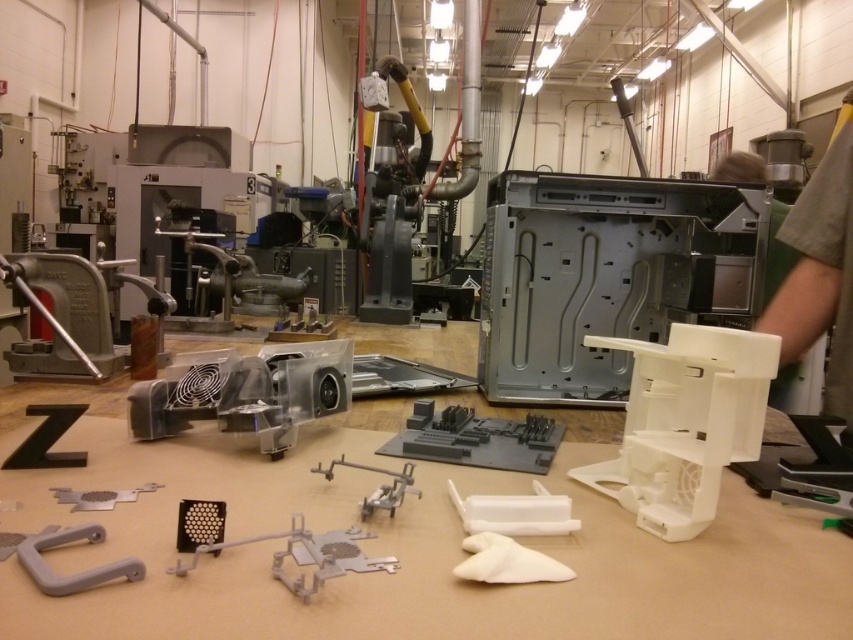
You are a technician in a workshop and need to reach the gray matte plastic handle at lower left. The robotic arm in the background has a maximum reach of 24 inches. Can the robotic arm retrieve the handle?

The gray matte plastic handle at lower left is 23.98 inches from the camera, so the robotic arm with a maximum reach of 24 inches can just barely retrieve it.